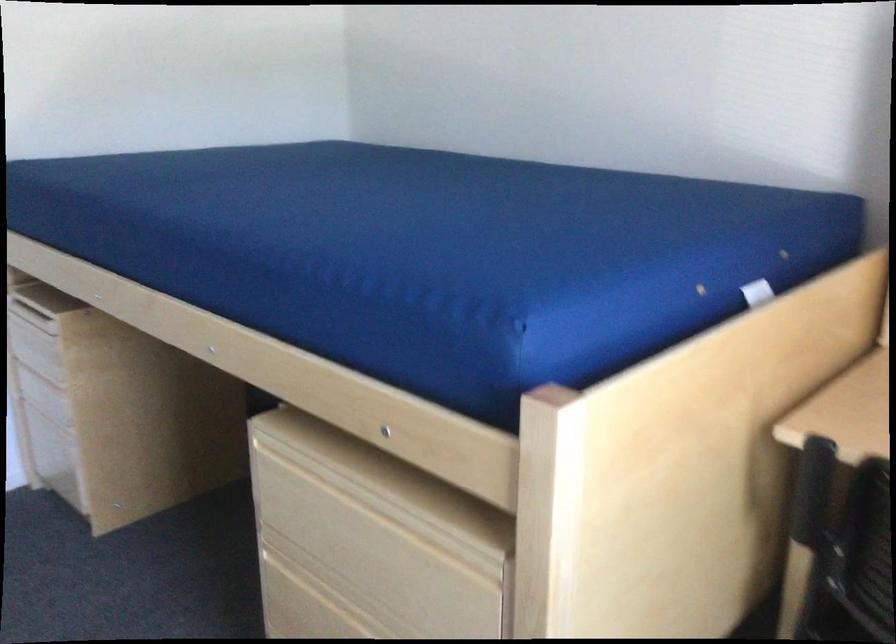
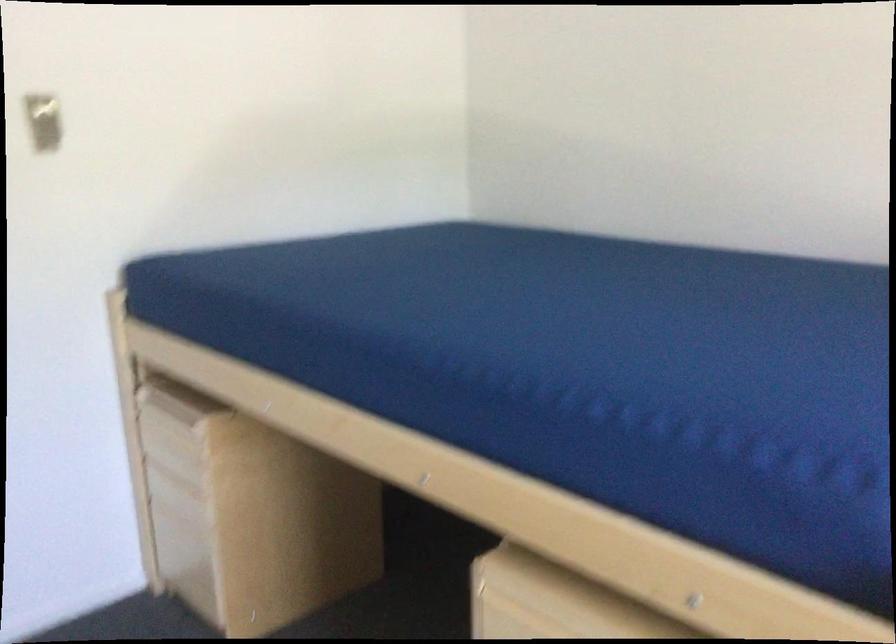
Question: Based on the continuous images, in which direction is the camera rotating? Reply with the corresponding letter.

Choices:
 (A) Left
 (B) Right
 (C) Up
 (D) Down

Answer: (C)